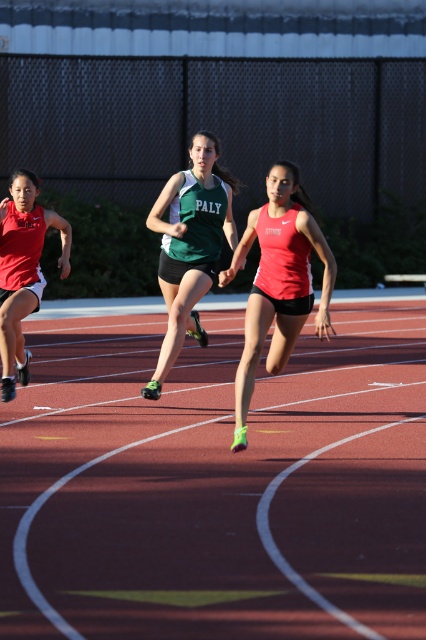
Can you confirm if red rubber track at center is taller than matte red tank top at left?

No, red rubber track at center is not taller than matte red tank top at left.

Is red rubber track at center below matte red tank top at left?

Correct, red rubber track at center is located below matte red tank top at left.

Describe the element at coordinates (213, 481) in the screenshot. Image resolution: width=426 pixels, height=640 pixels. I see `red rubber track at center` at that location.

The image size is (426, 640). I want to click on red rubber track at center, so click(213, 481).

Does matte red tank top at center appear on the right side of green matte jersey at center?

Correct, you'll find matte red tank top at center to the right of green matte jersey at center.

In order to click on matte red tank top at center in this screenshot , I will do `click(278, 284)`.

Does green matte jersey at center have a greater height compared to matte red tank top at left?

Yes, green matte jersey at center is taller than matte red tank top at left.

Who is positioned more to the right, green matte jersey at center or matte red tank top at left?

From the viewer's perspective, green matte jersey at center appears more on the right side.

The image size is (426, 640). Find the location of `green matte jersey at center`. green matte jersey at center is located at coordinates (189, 244).